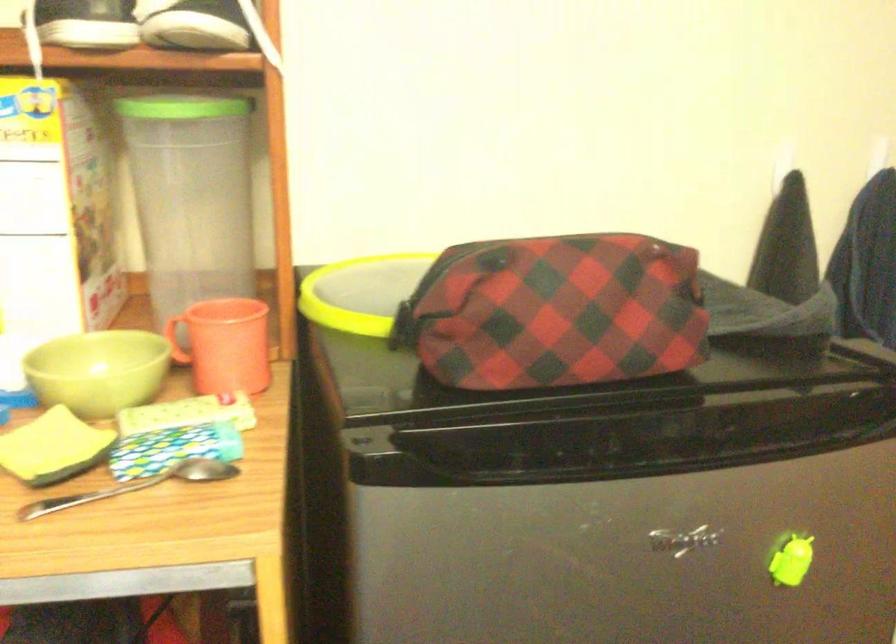
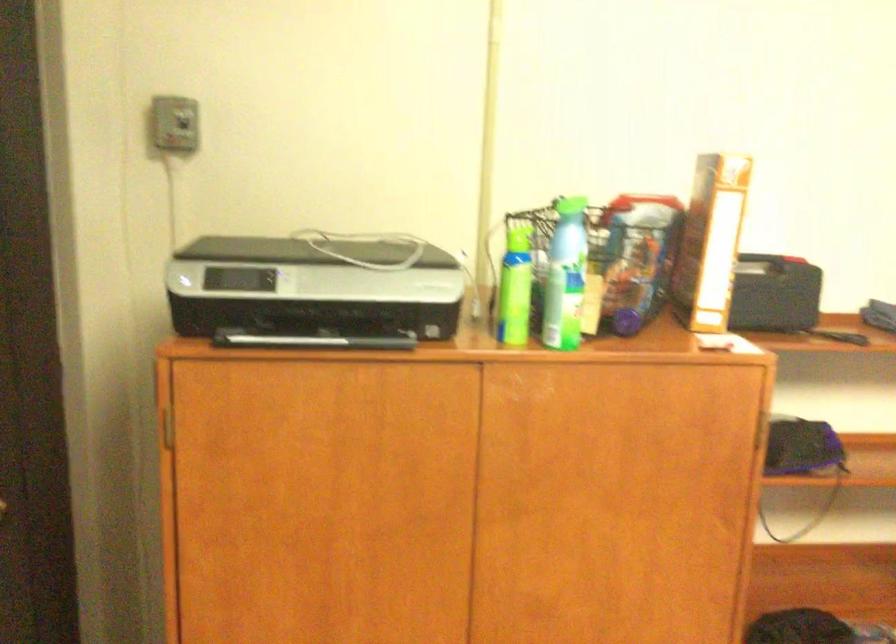
Question: The camera is either moving clockwise (left) or counter-clockwise (right) around the object. The first image is from the beginning of the video and the second image is from the end. Is the camera moving left or right when shooting the video?

Choices:
 (A) Left
 (B) Right

Answer: (A)